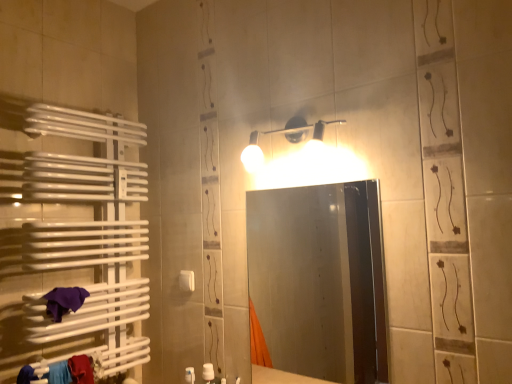
Question: From the image's perspective, is matte white light fixture at upper center located beneath smooth glass mirror at center?

Choices:
 (A) yes
 (B) no

Answer: (B)

Question: Is matte white light fixture at upper center closer to camera compared to smooth glass mirror at center?

Choices:
 (A) no
 (B) yes

Answer: (A)

Question: Could you tell me if matte white light fixture at upper center is turned towards smooth glass mirror at center?

Choices:
 (A) no
 (B) yes

Answer: (A)

Question: From the image's perspective, is matte white light fixture at upper center above smooth glass mirror at center?

Choices:
 (A) yes
 (B) no

Answer: (A)

Question: Is matte white light fixture at upper center to the left of smooth glass mirror at center from the viewer's perspective?

Choices:
 (A) yes
 (B) no

Answer: (A)

Question: Considering the relative sizes of matte white light fixture at upper center and smooth glass mirror at center in the image provided, is matte white light fixture at upper center wider than smooth glass mirror at center?

Choices:
 (A) no
 (B) yes

Answer: (B)

Question: From the image's perspective, does white plastic towel bar at lower left appear lower than matte white light fixture at upper center?

Choices:
 (A) no
 (B) yes

Answer: (B)

Question: From a real-world perspective, is white plastic towel bar at lower left below matte white light fixture at upper center?

Choices:
 (A) yes
 (B) no

Answer: (A)

Question: Considering the relative positions of white plastic towel bar at lower left and matte white light fixture at upper center in the image provided, is white plastic towel bar at lower left to the left of matte white light fixture at upper center from the viewer's perspective?

Choices:
 (A) no
 (B) yes

Answer: (B)

Question: Is white plastic towel bar at lower left directly adjacent to matte white light fixture at upper center?

Choices:
 (A) yes
 (B) no

Answer: (B)

Question: Would you consider white plastic towel bar at lower left to be distant from matte white light fixture at upper center?

Choices:
 (A) yes
 (B) no

Answer: (B)

Question: Is white plastic towel bar at lower left further to camera compared to matte white light fixture at upper center?

Choices:
 (A) yes
 (B) no

Answer: (A)

Question: Is smooth glass mirror at center taller than purple cloth at lower left?

Choices:
 (A) no
 (B) yes

Answer: (B)